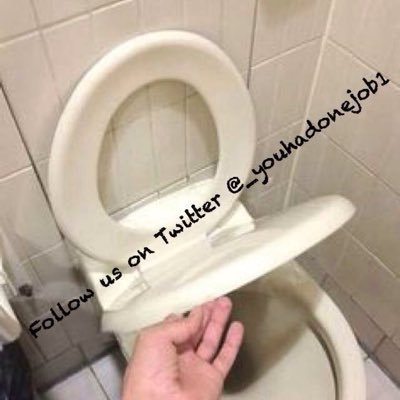
Locate an element on the screen. The image size is (400, 400). white tiled wall is located at coordinates (363, 145), (17, 90).